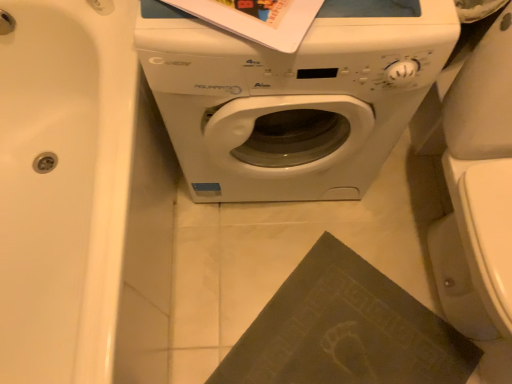
This screenshot has width=512, height=384. In order to click on free point above dark matte book at lower right (from a real-world perspective) in this screenshot , I will do (350, 332).